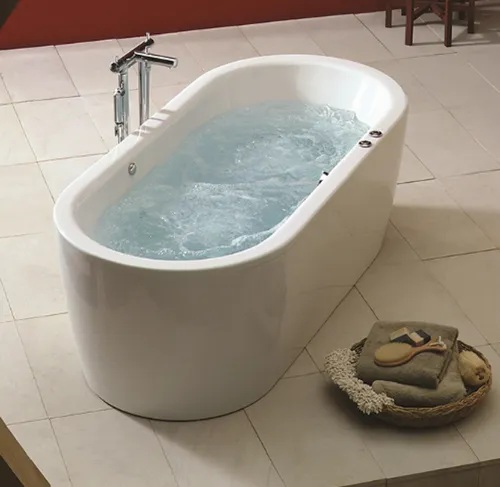
Identify the location of gold border. This screenshot has width=500, height=487. (19, 458).